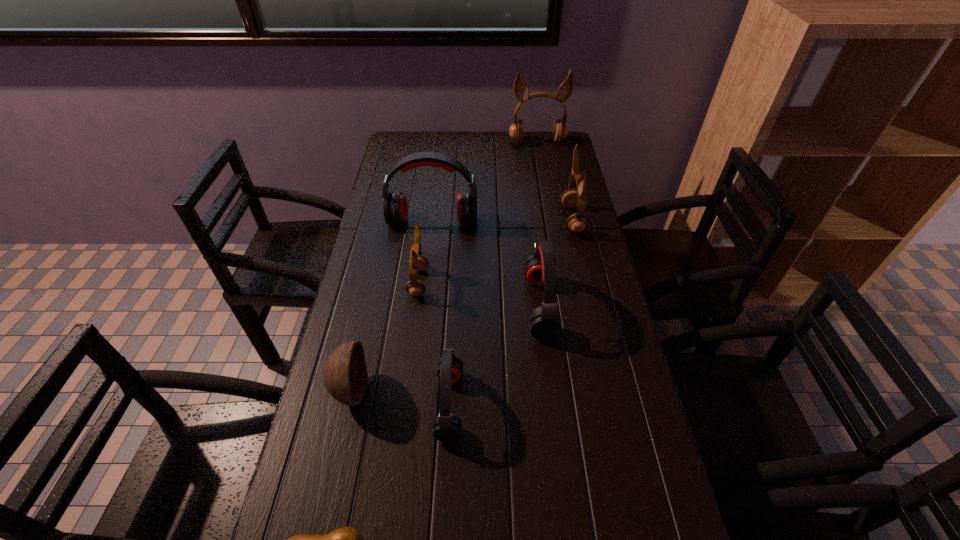
Where is `the farthest object`? This screenshot has height=540, width=960. the farthest object is located at coordinates (521, 90).

You are a GUI agent. You are given a task and a screenshot of the screen. Output one action in this format:
    pyautogui.click(x=<x>, y=<y>)
    Task: Click on the tallest object
    
    Given the screenshot: What is the action you would take?
    pyautogui.click(x=521, y=90)

Image resolution: width=960 pixels, height=540 pixels. Find the location of `the biggest red earphone`. the biggest red earphone is located at coordinates (395, 207).

This screenshot has height=540, width=960. In order to click on the second smallest brown earphone in this screenshot , I will do `click(571, 198)`.

Image resolution: width=960 pixels, height=540 pixels. I want to click on the rightmost red earphone, so click(x=545, y=321).

Image resolution: width=960 pixels, height=540 pixels. Find the location of `the second smallest red earphone`. the second smallest red earphone is located at coordinates tap(545, 321).

Where is `the leftmost brown earphone`? This screenshot has width=960, height=540. the leftmost brown earphone is located at coordinates (414, 287).

You are a GUI agent. You are given a task and a screenshot of the screen. Output one action in this format:
    pyautogui.click(x=<x>, y=<y>)
    Task: Click on the smallest brown earphone
    
    Given the screenshot: What is the action you would take?
    pyautogui.click(x=414, y=287)

Identify the location of the smallest red earphone. The height and width of the screenshot is (540, 960). (446, 426).

This screenshot has width=960, height=540. Identify the location of the nearest red earphone. (446, 426).